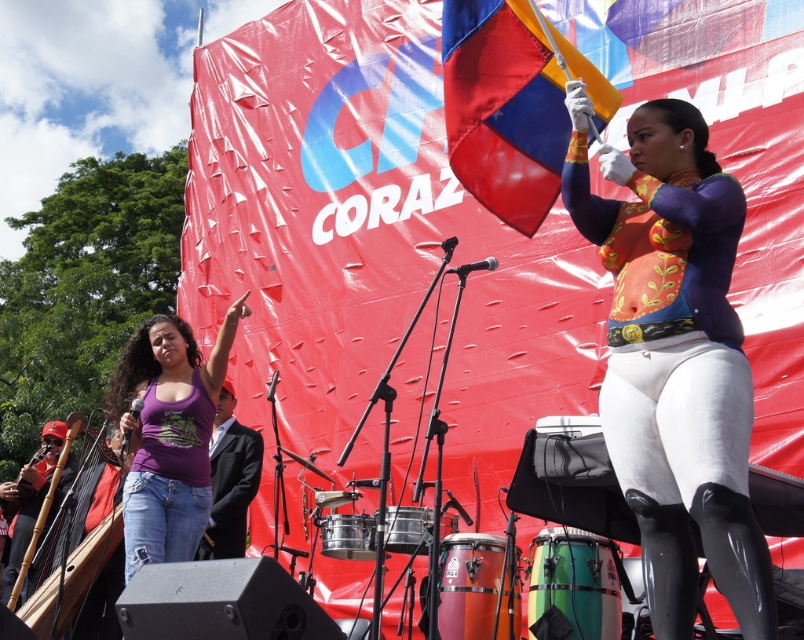
You are an event photographer at the cultural gathering. You need to capture a photo that includes both the purple cotton tank top at lower left and the purple fabric shirt at left. Which one of these two items will appear taller in the photo?

The purple cotton tank top at lower left will appear taller in the photo because it has a greater height compared to the purple fabric shirt at left according to the description.